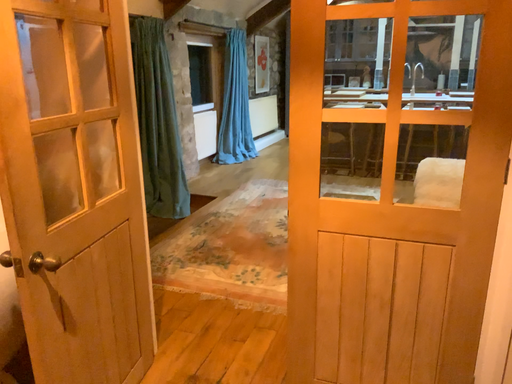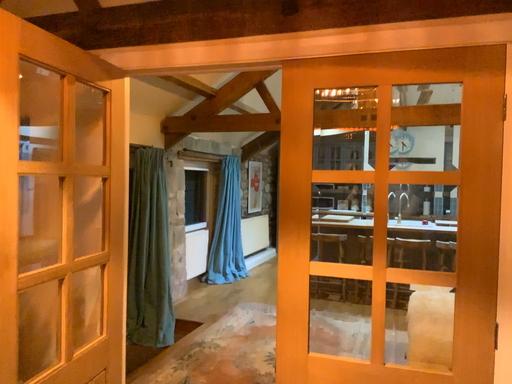
Question: Which way did the camera rotate in the video?

Choices:
 (A) rotated upward
 (B) rotated downward

Answer: (A)